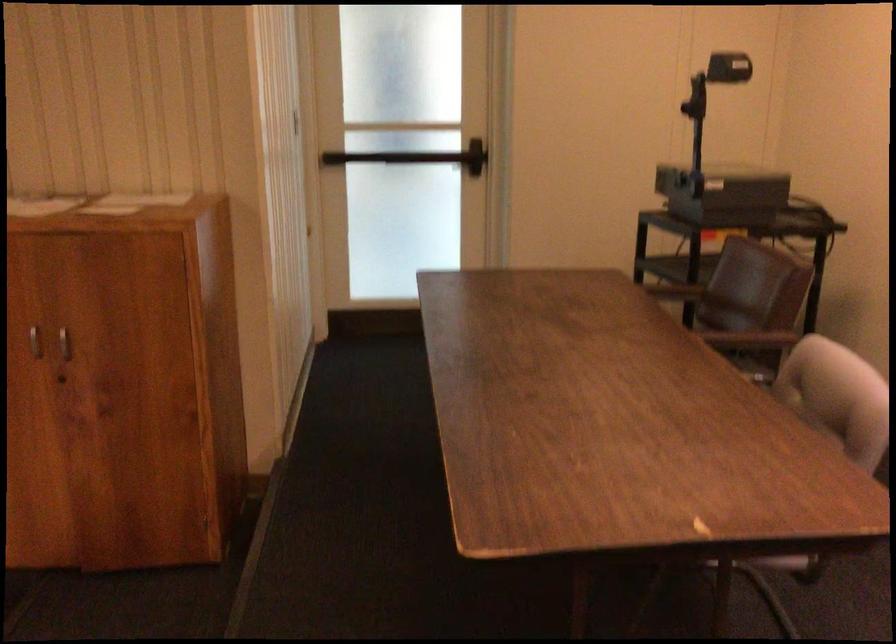
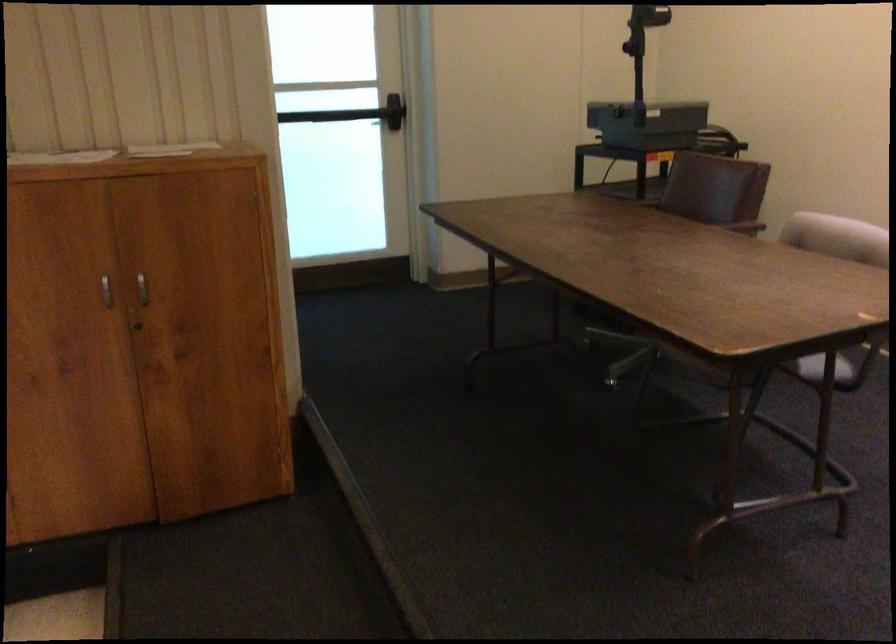
Question: What movement of the cameraman would produce the second image?

Choices:
 (A) Left
 (B) Right
 (C) Forward
 (D) Backward

Answer: (A)